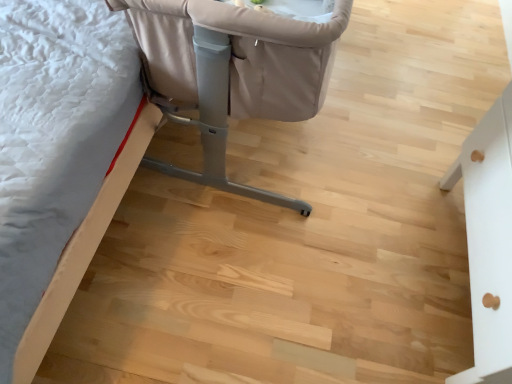
Question: Is white matte drawer at right, which appears as the third furniture when viewed from the left, not close to beige fabric crib at upper left, the 3th furniture in the right-to-left sequence?

Choices:
 (A) yes
 (B) no

Answer: (B)

Question: Considering the relative sizes of white matte drawer at right, which is counted as the first furniture, starting from the right, and beige fabric crib at upper left, the 3th furniture in the right-to-left sequence, in the image provided, is white matte drawer at right, which is counted as the first furniture, starting from the right, bigger than beige fabric crib at upper left, the 3th furniture in the right-to-left sequence,?

Choices:
 (A) yes
 (B) no

Answer: (B)

Question: Is white matte drawer at right, which is counted as the first furniture, starting from the right, at the left side of beige fabric crib at upper left, which is counted as the first furniture, starting from the left?

Choices:
 (A) yes
 (B) no

Answer: (B)

Question: Is white matte drawer at right, which is counted as the first furniture, starting from the right, in front of beige fabric crib at upper left, which is counted as the first furniture, starting from the left?

Choices:
 (A) no
 (B) yes

Answer: (B)

Question: Is white matte drawer at right, which appears as the third furniture when viewed from the left, at the right side of beige fabric crib at upper left, which is counted as the first furniture, starting from the left?

Choices:
 (A) yes
 (B) no

Answer: (A)

Question: From a real-world perspective, is white matte drawer at right, which appears as the third furniture when viewed from the left, below beige fabric crib at upper left, which is counted as the first furniture, starting from the left?

Choices:
 (A) yes
 (B) no

Answer: (B)

Question: Considering the relative sizes of white matte drawer at right, which appears as the third furniture when viewed from the left, and beige fabric crib at upper center, the second furniture from the right, in the image provided, is white matte drawer at right, which appears as the third furniture when viewed from the left, thinner than beige fabric crib at upper center, the second furniture from the right,?

Choices:
 (A) yes
 (B) no

Answer: (A)

Question: From a real-world perspective, is white matte drawer at right, which appears as the third furniture when viewed from the left, on beige fabric crib at upper center, arranged as the second furniture when viewed from the left?

Choices:
 (A) yes
 (B) no

Answer: (B)

Question: Can you confirm if white matte drawer at right, which appears as the third furniture when viewed from the left, is positioned to the left of beige fabric crib at upper center, the second furniture from the right?

Choices:
 (A) yes
 (B) no

Answer: (B)

Question: Is white matte drawer at right, which is counted as the first furniture, starting from the right, outside beige fabric crib at upper center, arranged as the second furniture when viewed from the left?

Choices:
 (A) no
 (B) yes

Answer: (B)

Question: Considering the relative positions of white matte drawer at right, which is counted as the first furniture, starting from the right, and beige fabric crib at upper center, the second furniture from the right, in the image provided, is white matte drawer at right, which is counted as the first furniture, starting from the right, to the right of beige fabric crib at upper center, the second furniture from the right, from the viewer's perspective?

Choices:
 (A) no
 (B) yes

Answer: (B)

Question: Is white matte drawer at right, which is counted as the first furniture, starting from the right, positioned behind beige fabric crib at upper center, the second furniture from the right?

Choices:
 (A) yes
 (B) no

Answer: (B)

Question: Considering the relative sizes of beige fabric crib at upper center, the second furniture from the right, and beige fabric crib at upper left, which is counted as the first furniture, starting from the left, in the image provided, is beige fabric crib at upper center, the second furniture from the right, thinner than beige fabric crib at upper left, which is counted as the first furniture, starting from the left,?

Choices:
 (A) no
 (B) yes

Answer: (B)